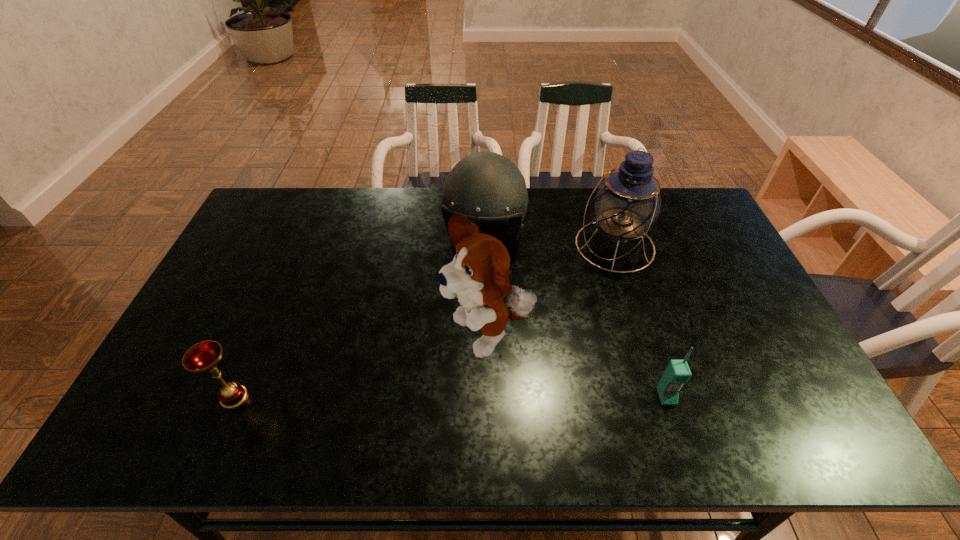
At what (x,y) coordinates should I click in order to perform the action: click on free space on the desktop that is between the chalice and the cellular telephone and is positioned on the front-facing side of the lantern. Please return your answer as a coordinate pair (x, y). The width and height of the screenshot is (960, 540). Looking at the image, I should click on (422, 397).

Image resolution: width=960 pixels, height=540 pixels. I want to click on vacant space on the desktop that is between the chalice and the cellular telephone and is positioned on the face of the third farthest object, so (x=408, y=397).

The image size is (960, 540). Find the location of `vacant spot on the desktop that is between the leftmost object and the cellular telephone and is positioned at the face opening of the football helmet`. vacant spot on the desktop that is between the leftmost object and the cellular telephone and is positioned at the face opening of the football helmet is located at coordinates (448, 397).